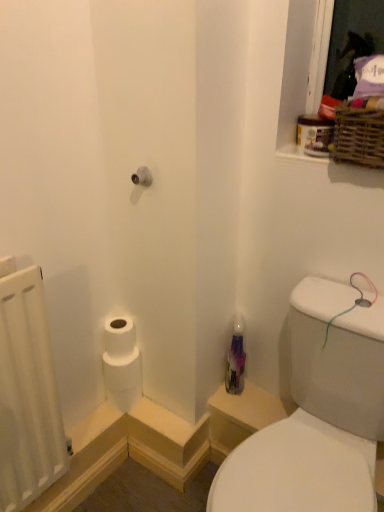
The height and width of the screenshot is (512, 384). I want to click on spots to the right of translucent purple bottle at center, so point(260,395).